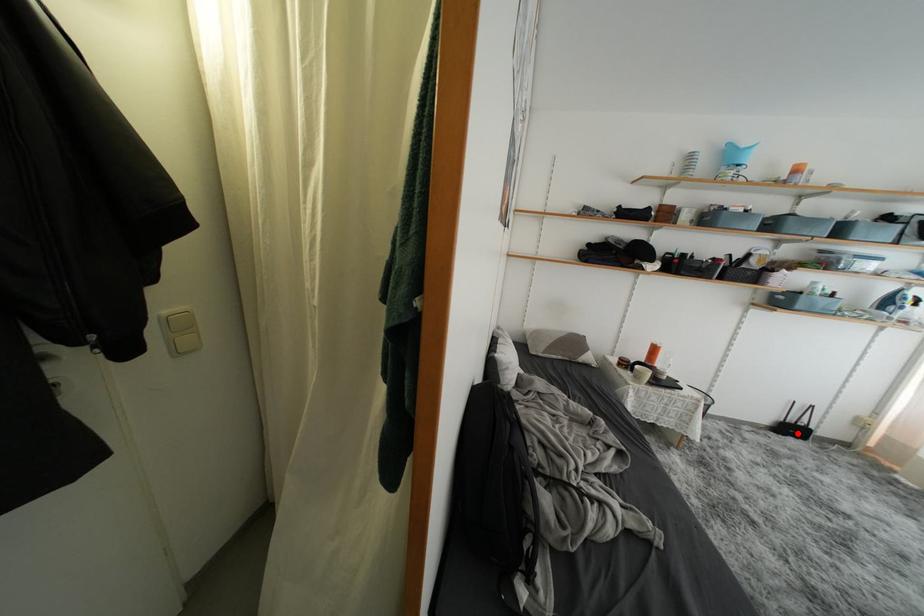
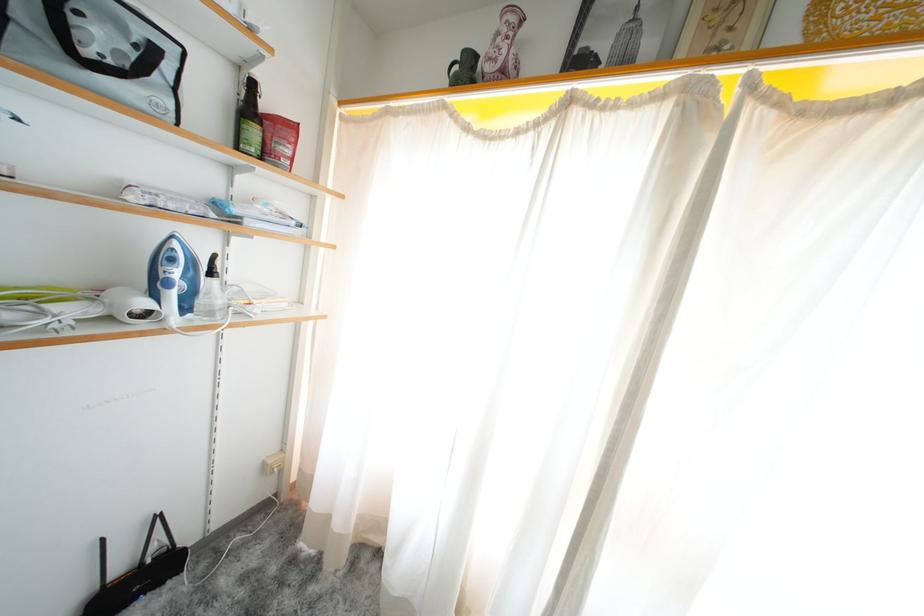
Where in the second image is the point corresponding to the highlighted location from the first image?

(143, 586)